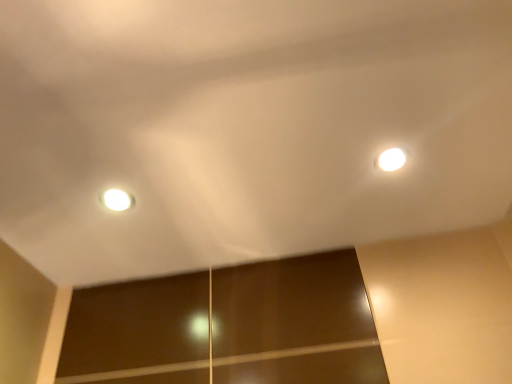
What is the approximate width of white glossy light fixture at upper right?

white glossy light fixture at upper right is 2.98 inches in width.

Identify the location of white glossy light fixture at upper right. The image size is (512, 384). (391, 159).

In order to face white glossy light fixture at upper right, should I rotate leftwards or rightwards?

To face it directly, rotate right by 17.938 degrees.

The width and height of the screenshot is (512, 384). Describe the element at coordinates (391, 159) in the screenshot. I see `white glossy light fixture at upper right` at that location.

The image size is (512, 384). What are the coordinates of `white glossy light fixture at upper right` in the screenshot? It's located at (391, 159).